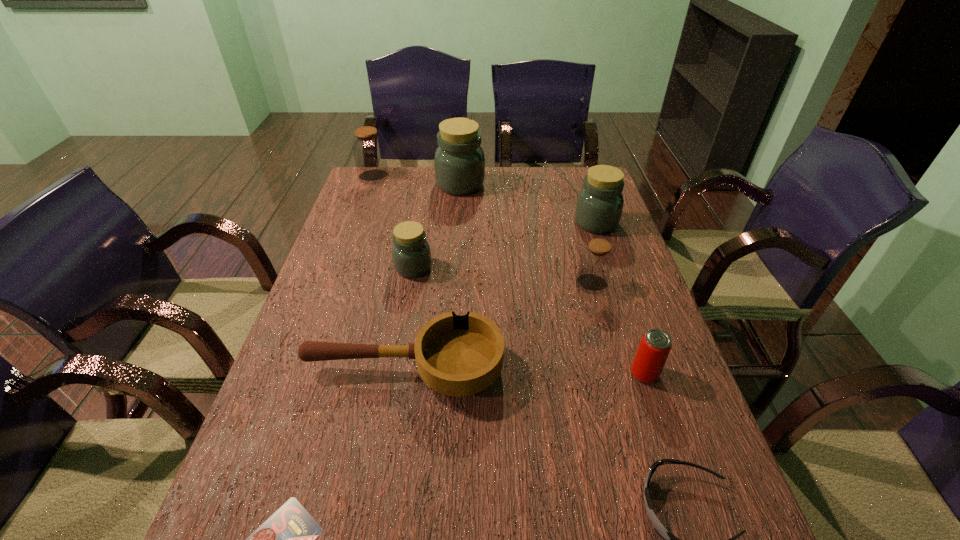
Where is `the farthest green jar`? the farthest green jar is located at coordinates (459, 163).

Locate an element on the screen. the biggest green jar is located at coordinates (459, 163).

Find the location of a particular element. the leftmost jar is located at coordinates (368, 148).

Identify the location of the left brown jar. The image size is (960, 540). (368, 148).

Locate an element on the screen. the third farthest object is located at coordinates (599, 206).

Identify the location of the third nearest jar. (599, 206).

You are a GUI agent. You are given a task and a screenshot of the screen. Output one action in this format:
    pyautogui.click(x=<x>, y=<y>)
    Task: Click on the nearest green jar
    The height and width of the screenshot is (540, 960).
    Given the screenshot: What is the action you would take?
    pyautogui.click(x=411, y=254)

Where is `the smaller brown jar`? the smaller brown jar is located at coordinates (596, 261).

The height and width of the screenshot is (540, 960). Identify the location of the nearer brown jar. 596,261.

Locate an element on the screen. Image resolution: width=960 pixels, height=540 pixels. beer can is located at coordinates (654, 348).